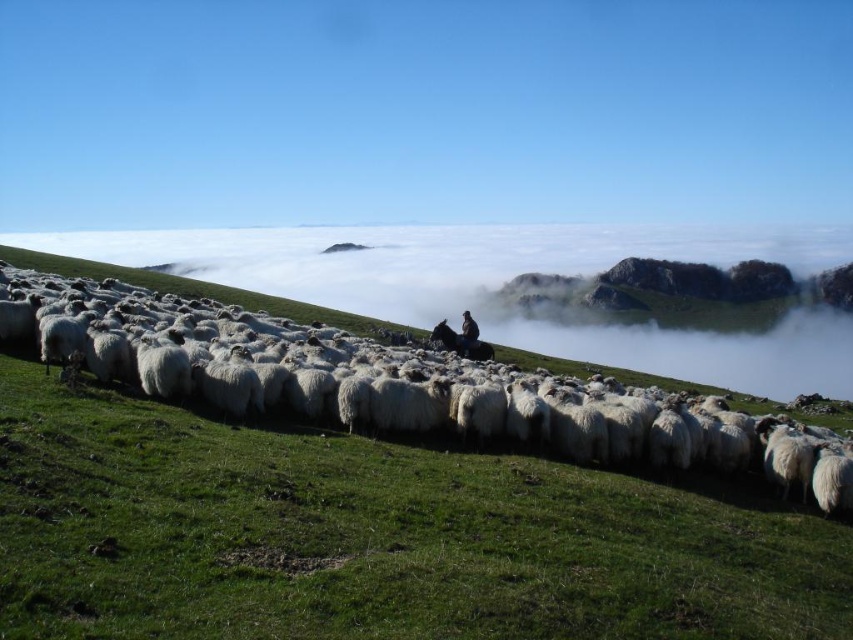
Between white fluffy wool at center and dark brown fur at center, which one appears on the left side from the viewer's perspective?

From the viewer's perspective, white fluffy wool at center appears more on the left side.

Can you confirm if white fluffy wool at center is positioned to the left of dark brown fur at center?

Correct, you'll find white fluffy wool at center to the left of dark brown fur at center.

Who is more forward, (688, 470) or (474, 344)?

Point (688, 470)

At what (x,y) coordinates should I click in order to perform the action: click on white fluffy wool at center. Please return your answer as a coordinate pair (x, y). Looking at the image, I should click on (402, 387).